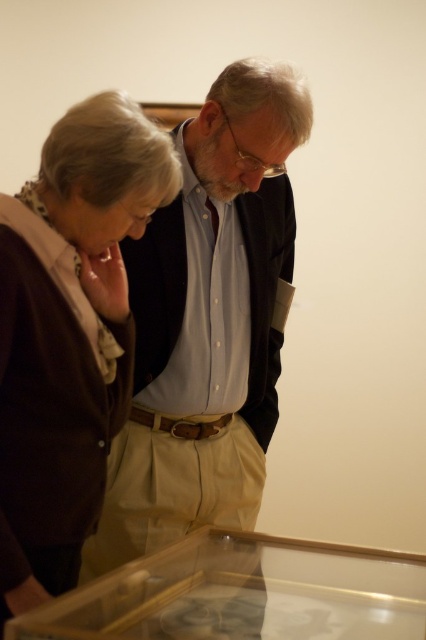
You are standing in the same room as the two people in the image. You want to walk directly to the transparent glass case at lower center without moving the people. Which direction should you move relative to the brown cardigan at left?

Since the brown cardigan at left is closer to you than the transparent glass case at lower center, you should move away from the brown cardigan at left towards the transparent glass case at lower center.